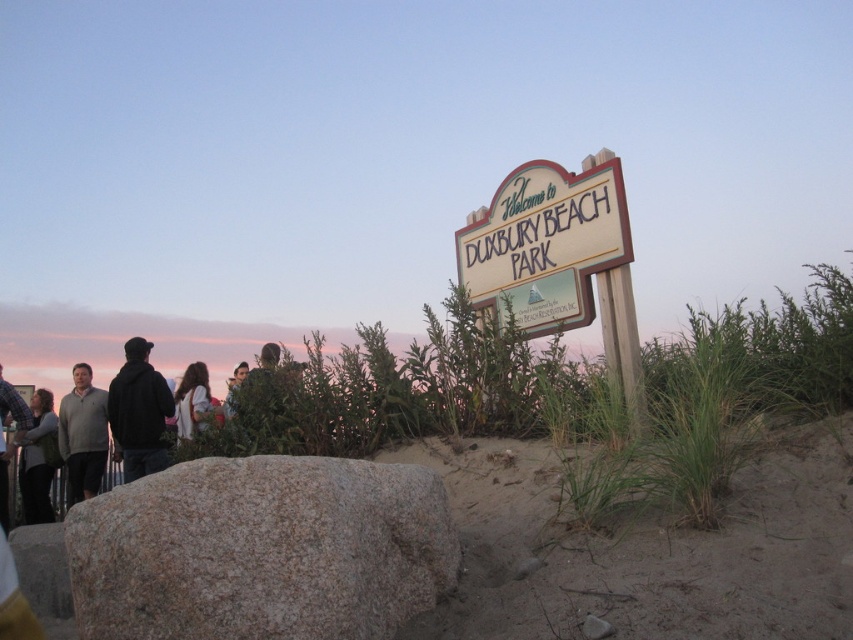
You are a photographer trying to capture a clear shot of the sign at Duxbury Beach Park. You notice a black hoodie at left and a light brown hair at center in your frame. Which object should you move to get a better view of the sign?

The black hoodie at left is positioned on the left side of light brown hair at center, so moving the black hoodie at left would provide a clearer view of the sign since it is closer to the sign and obscuring part of it.

You are standing at the beach and see two gray sweaters, the gray sweater at left and the matte gray sweater at lower left. Which one is nearer to you?

The gray sweater at left is closer to the viewer than the matte gray sweater at lower left.